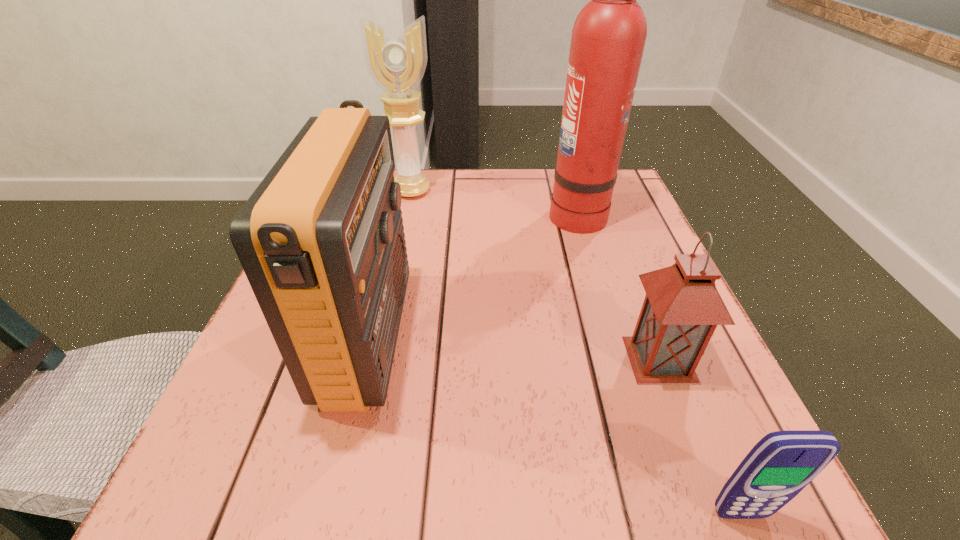
Locate an element on the screen. empty space between the lantern and the shortest object is located at coordinates (700, 436).

Locate an element on the screen. free spot between the fourth tallest object and the radio receiver is located at coordinates (514, 349).

Find the location of a particular element. free space between the award and the tallest object is located at coordinates (494, 202).

This screenshot has height=540, width=960. What are the coordinates of `vacant space that is in between the fire extinguisher and the lantern` in the screenshot? It's located at (618, 286).

Where is `vacant area between the radio receiver and the tallest object`? The image size is (960, 540). vacant area between the radio receiver and the tallest object is located at coordinates (472, 275).

Where is `free area in between the second shortest object and the radio receiver`? Image resolution: width=960 pixels, height=540 pixels. free area in between the second shortest object and the radio receiver is located at coordinates (514, 349).

Locate an element on the screen. The width and height of the screenshot is (960, 540). free space between the nearest object and the radio receiver is located at coordinates (554, 426).

Locate which object ranks third in proximity to the tallest object. Please provide its 2D coordinates. Your answer should be formatted as a tuple, i.e. [(x, y)], where the tuple contains the x and y coordinates of a point satisfying the conditions above.

[(321, 240)]

Locate an element on the screen. This screenshot has width=960, height=540. object that is the closest to the fire extinguisher is located at coordinates (396, 62).

I want to click on vacant region that satisfies the following two spatial constraints: 1. on the front-facing side of the award; 2. on the front-facing side of the radio receiver, so click(x=378, y=338).